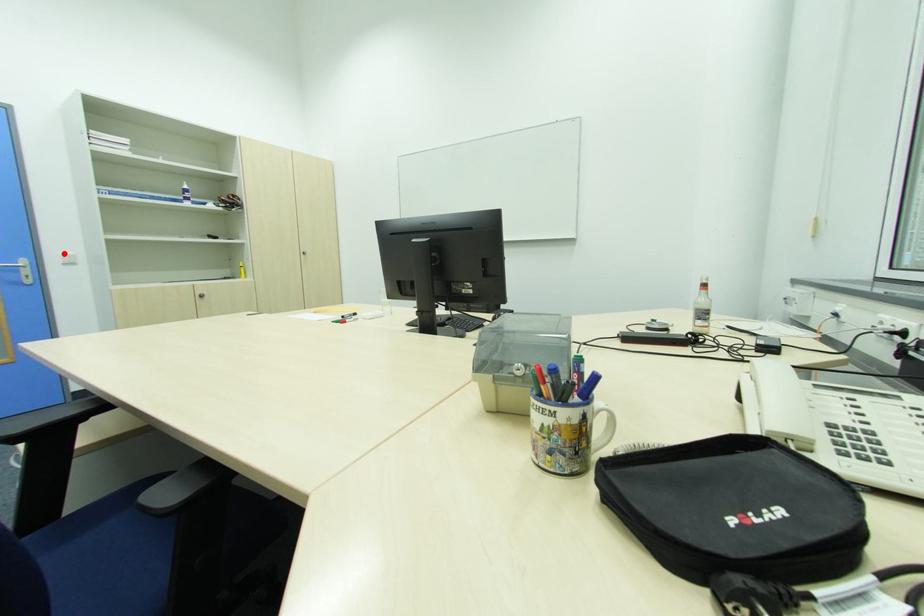
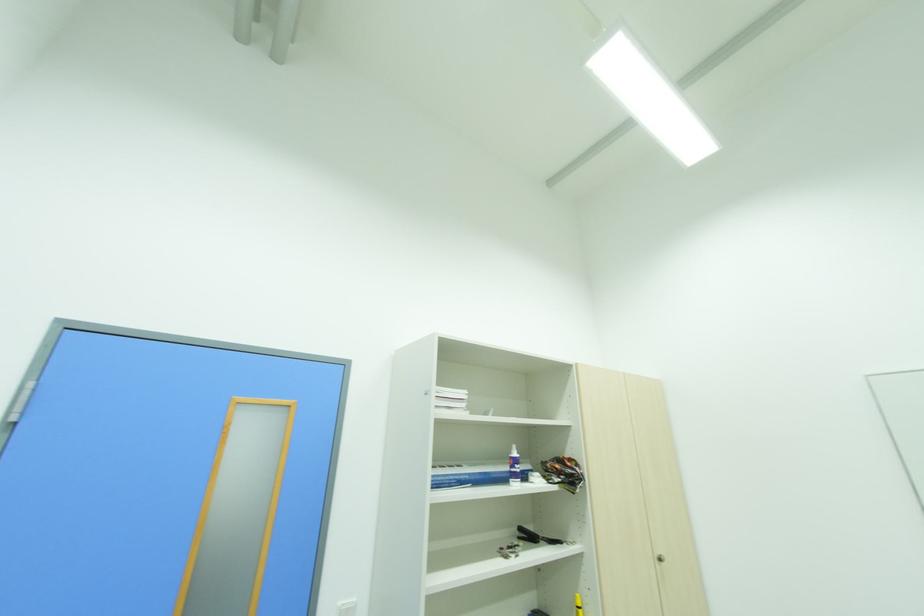
Find the pixel in the second image that matches the highlighted location in the first image.

(344, 604)